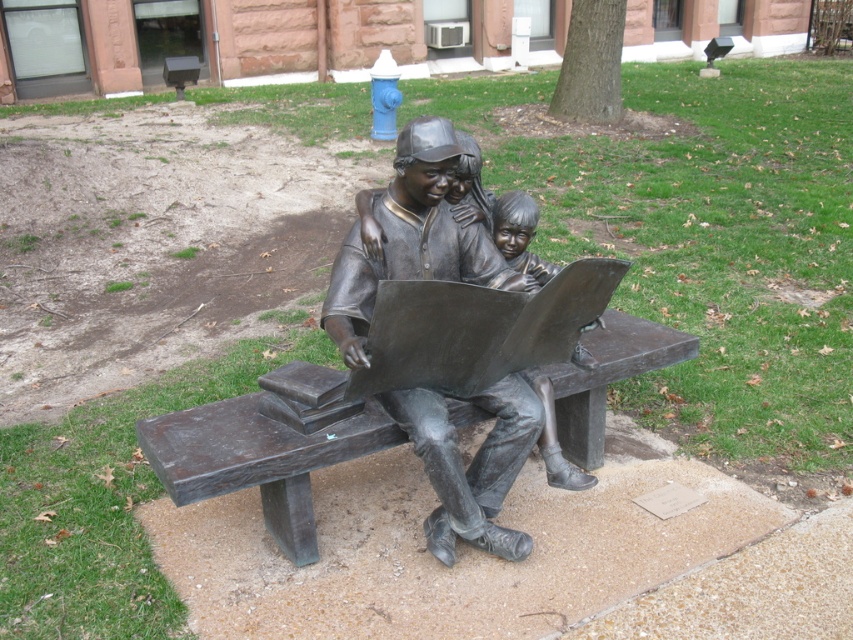
Question: Does bronze statue at center appear on the left side of bronze bench at center?

Choices:
 (A) yes
 (B) no

Answer: (B)

Question: Which of the following is the closest to the observer?

Choices:
 (A) (428, 440)
 (B) (279, 380)

Answer: (A)

Question: Can you confirm if bronze statue at center is positioned to the left of bronze bench at center?

Choices:
 (A) yes
 (B) no

Answer: (B)

Question: Among these points, which one is farthest from the camera?

Choices:
 (A) (265, 388)
 (B) (425, 460)

Answer: (A)

Question: Does bronze statue at center have a greater width compared to bronze bench at center?

Choices:
 (A) no
 (B) yes

Answer: (A)